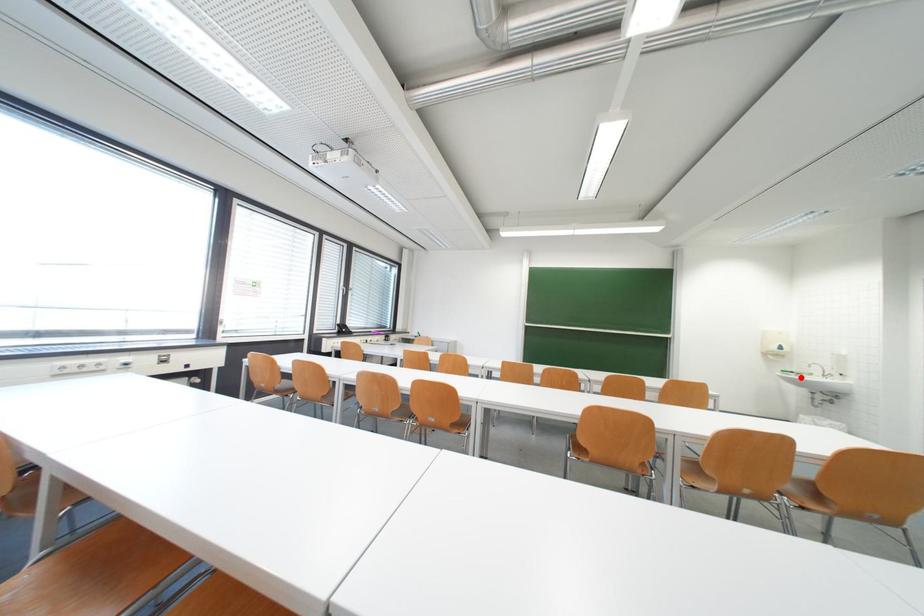
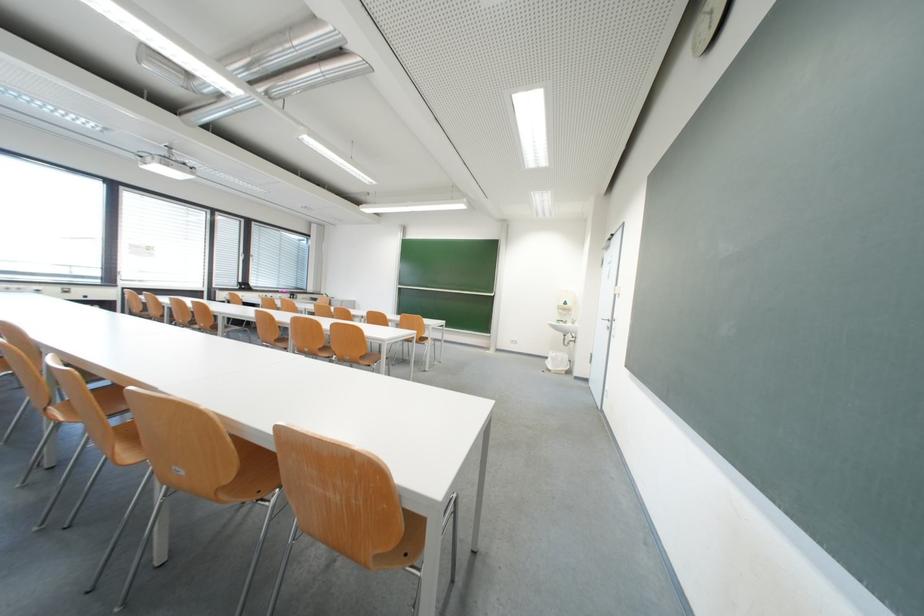
Question: I am providing you with two images of the same scene from different viewpoints. Given a red point in image1, look at the same physical point in image2. Is it:

Choices:
 (A) Closer to the viewpoint
 (B) Farther from the viewpoint

Answer: (A)